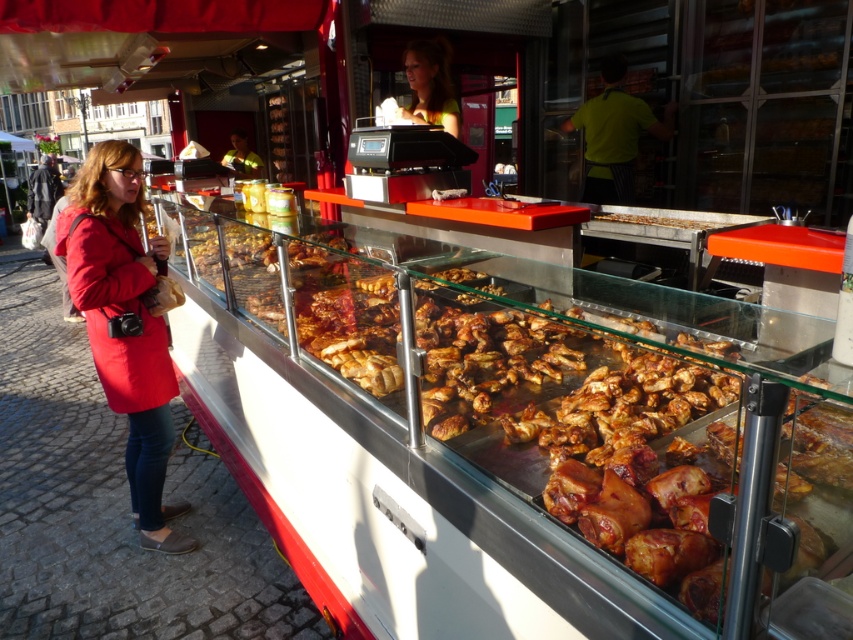
Question: Among these objects, which one is nearest to the camera?

Choices:
 (A) blonde hair at upper center
 (B) reflective yellow jacket at center

Answer: (A)

Question: Does blonde hair at upper center appear over reflective yellow jacket at center?

Choices:
 (A) no
 (B) yes

Answer: (A)

Question: Among these objects, which one is nearest to the camera?

Choices:
 (A) reflective yellow jacket at center
 (B) matte red coat at left

Answer: (B)

Question: Is blonde hair at upper center below reflective yellow jacket at center?

Choices:
 (A) yes
 (B) no

Answer: (A)

Question: Is the position of matte red coat at left less distant than that of brown crispy bread at center?

Choices:
 (A) yes
 (B) no

Answer: (A)

Question: Which point is closer to the camera?

Choices:
 (A) (415, 118)
 (B) (137, 314)
 (C) (229, 138)

Answer: (B)